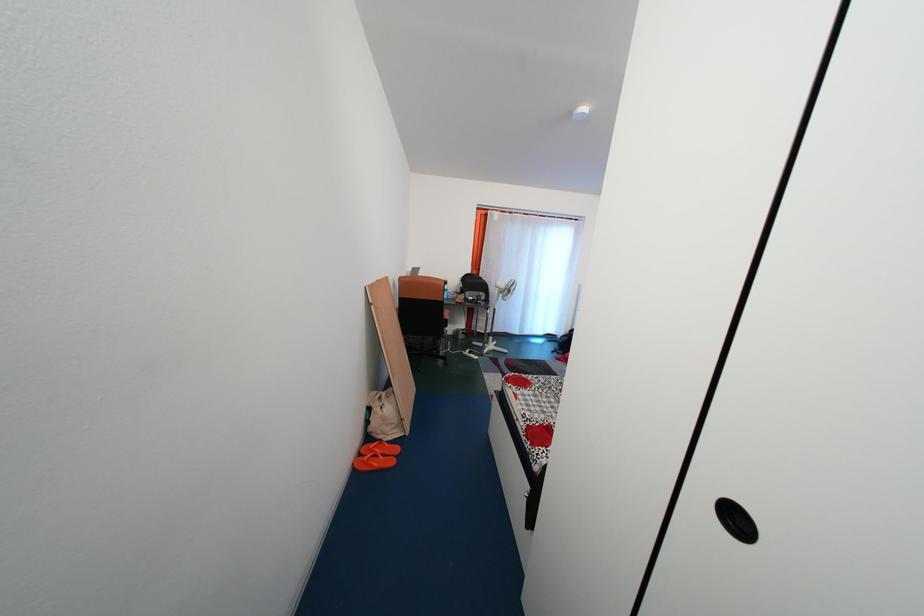
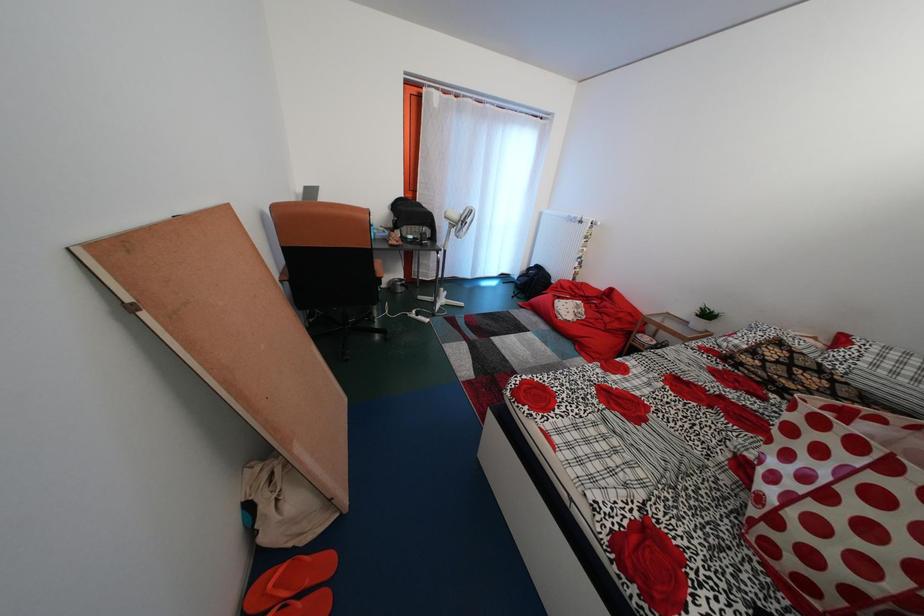
Question: The images are taken continuously from a first-person perspective. In which direction are you moving?

Choices:
 (A) Left
 (B) Right
 (C) Forward
 (D) Backward

Answer: (C)